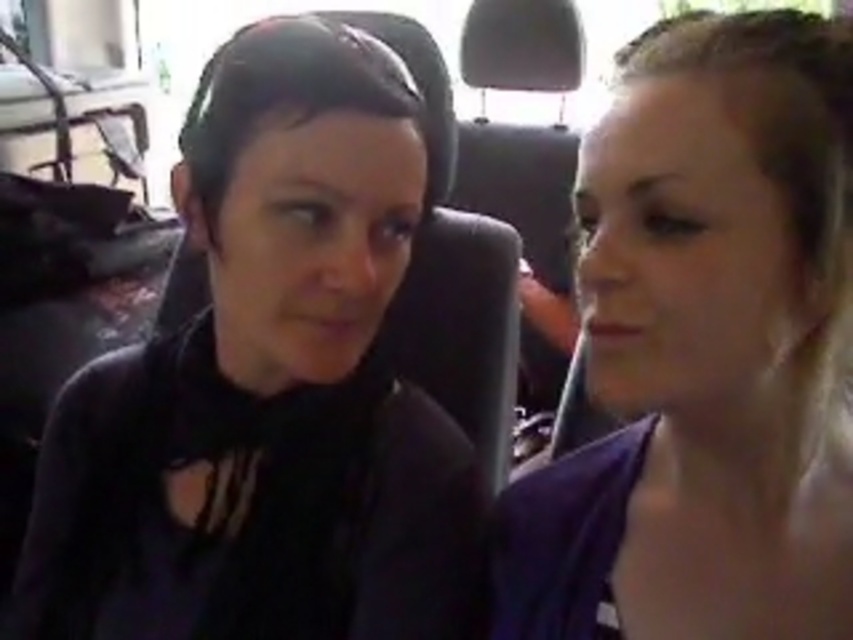
Does black matte shirt at left appear on the right side of purple fabric at right?

In fact, black matte shirt at left is to the left of purple fabric at right.

Between black matte shirt at left and purple fabric at right, which one appears on the left side from the viewer's perspective?

black matte shirt at left is more to the left.

Does point (16, 608) lie in front of point (596, 554)?

No, it is behind (596, 554).

At what (x,y) coordinates should I click in order to perform the action: click on black matte shirt at left. Please return your answer as a coordinate pair (x, y). The width and height of the screenshot is (853, 640). Looking at the image, I should click on (268, 387).